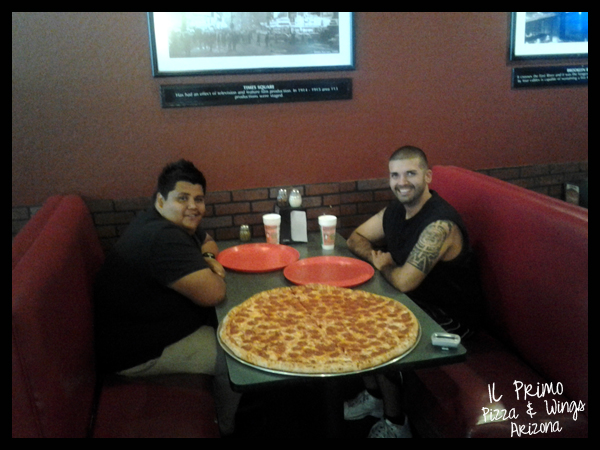
Where is `red plates`? The image size is (600, 450). red plates is located at coordinates (329, 270), (242, 258).